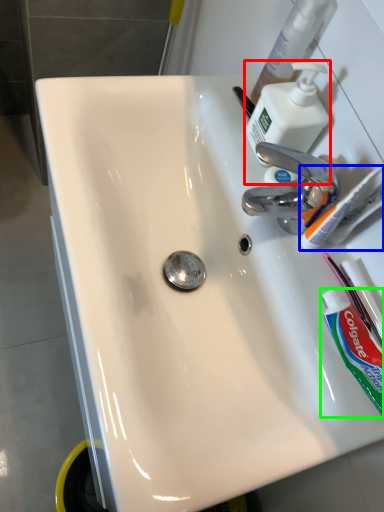
Question: Estimate the real-world distances between objects in this image. Which object is farther from soap dispenser (highlighted by a red box), toothbrush (highlighted by a blue box) or toothpaste (highlighted by a green box)?

Choices:
 (A) toothbrush
 (B) toothpaste

Answer: (B)